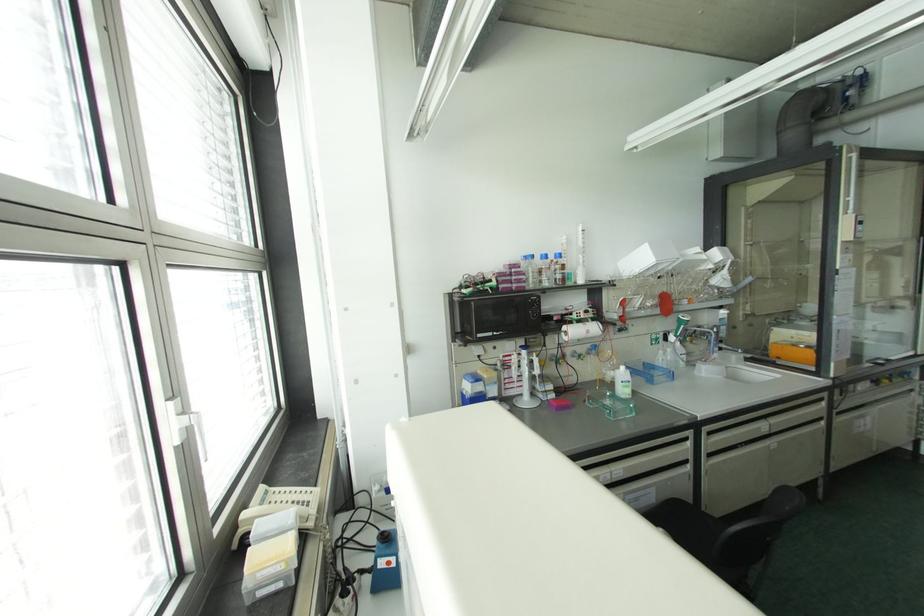
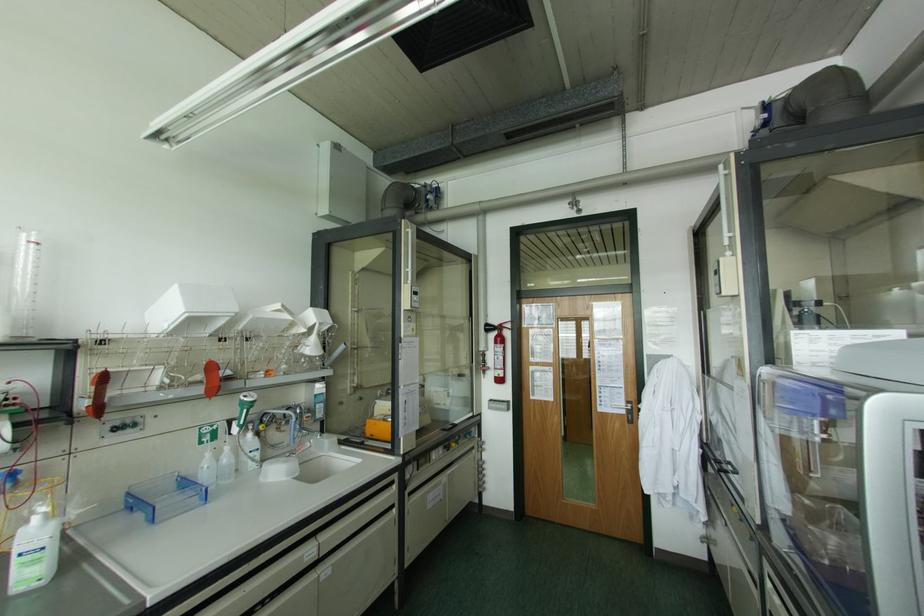
Find the pixel in the second image that matches (x=586, y=274) in the first image.

(16, 323)